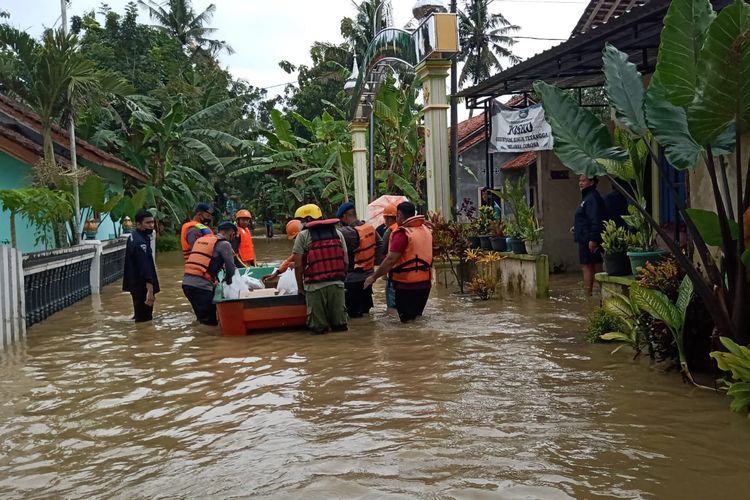
Locate an element on the screen. pots is located at coordinates (532, 250), (516, 244), (502, 242), (487, 241).